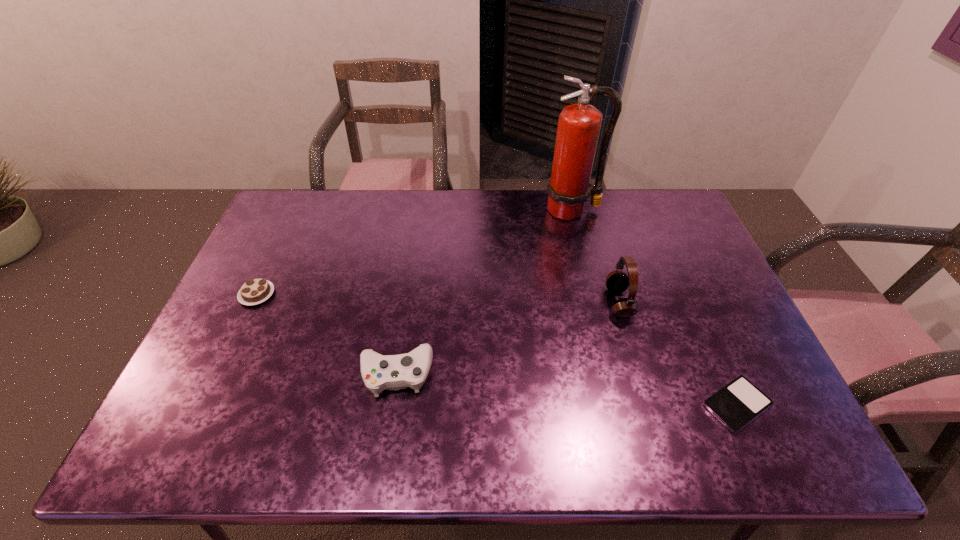
In order to click on vacant region that satisfies the following two spatial constraints: 1. on the front side of the third tallest object; 2. on the left side of the shortest object in this screenshot , I will do `click(392, 404)`.

The width and height of the screenshot is (960, 540). I want to click on vacant region that satisfies the following two spatial constraints: 1. at the nozzle of the rightmost object; 2. on the left side of the farthest object, so click(x=617, y=404).

The height and width of the screenshot is (540, 960). I want to click on vacant space that satisfies the following two spatial constraints: 1. on the ear pads of the headset; 2. on the front side of the third shortest object, so click(x=639, y=373).